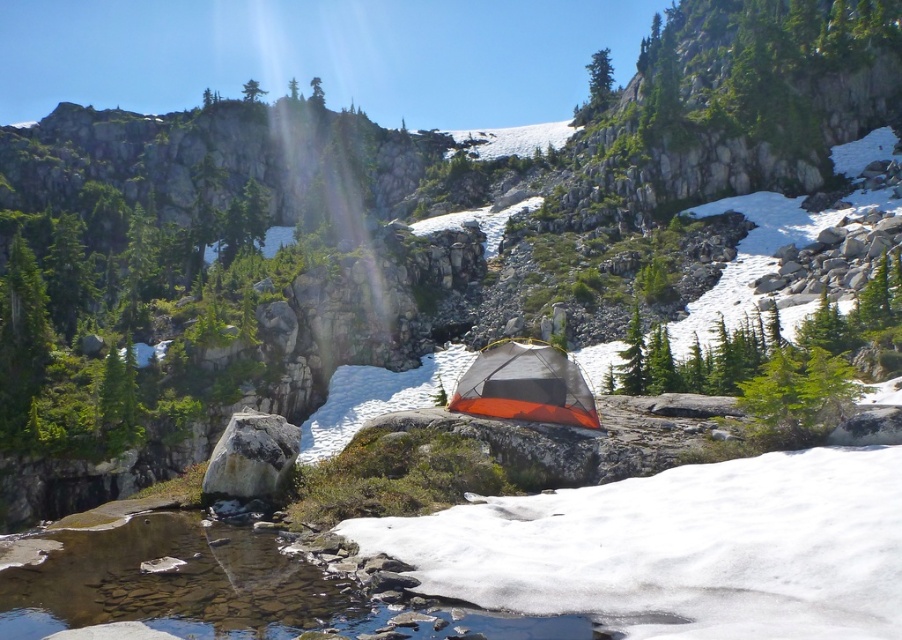
Does orange mesh tent at center appear under gray rock at center?

No.

Does orange mesh tent at center have a greater height compared to gray rock at center?

In fact, orange mesh tent at center may be shorter than gray rock at center.

Locate an element on the screen. orange mesh tent at center is located at coordinates (525, 385).

Does clear water at creek center have a smaller size compared to orange mesh tent at center?

No, clear water at creek center is not smaller than orange mesh tent at center.

Between clear water at creek center and orange mesh tent at center, which one appears on the right side from the viewer's perspective?

orange mesh tent at center is more to the right.

Find the location of `clear water at creek center`. clear water at creek center is located at coordinates (223, 589).

Locate an element on the screen. clear water at creek center is located at coordinates (223, 589).

Is clear water at creek center behind gray rock at center?

No, it is not.

Is clear water at creek center to the left of gray rock at center from the viewer's perspective?

Incorrect, clear water at creek center is not on the left side of gray rock at center.

Locate an element on the screen. The width and height of the screenshot is (902, 640). clear water at creek center is located at coordinates (223, 589).

Locate an element on the screen. The height and width of the screenshot is (640, 902). clear water at creek center is located at coordinates (223, 589).